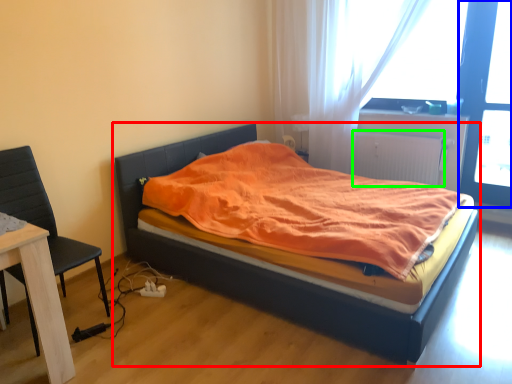
Question: Which is farther away from bed (highlighted by a red box)? screen door (highlighted by a blue box) or radiator (highlighted by a green box)?

Choices:
 (A) screen door
 (B) radiator

Answer: (A)